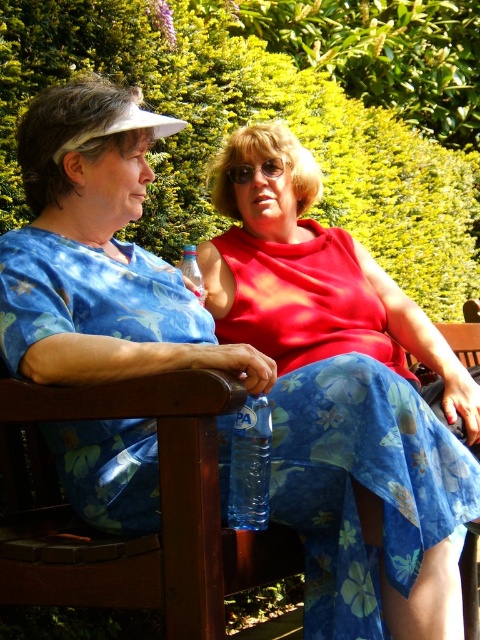
Does point (265, 401) lie behind point (192, 273)?

That is False.

Can you confirm if transparent plastic bottle at center is thinner than clear plastic bottle at center?

No, transparent plastic bottle at center is not thinner than clear plastic bottle at center.

Between point (254, 445) and point (196, 266), which one is positioned behind?

Point (196, 266)

Where is `transparent plastic bottle at center`? This screenshot has height=640, width=480. transparent plastic bottle at center is located at coordinates (250, 465).